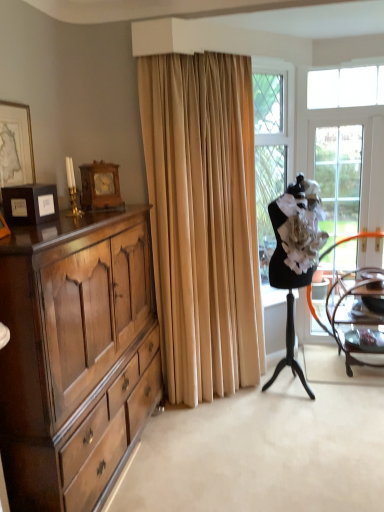
This screenshot has width=384, height=512. Describe the element at coordinates (75, 355) in the screenshot. I see `polished wood cabinet at left` at that location.

What do you see at coordinates (16, 145) in the screenshot?
I see `gold-framed picture at upper left` at bounding box center [16, 145].

The height and width of the screenshot is (512, 384). What do you see at coordinates (357, 315) in the screenshot? I see `wooden chair at right` at bounding box center [357, 315].

In order to click on polished wood cabinet at left in this screenshot , I will do `click(75, 355)`.

Which object is closer to the camera, clear glass screen door at right or wooden chair at right?

wooden chair at right is more forward.

Considering the positions of objects clear glass screen door at right and wooden chair at right in the image provided, who is more to the left, clear glass screen door at right or wooden chair at right?

From the viewer's perspective, clear glass screen door at right appears more on the left side.

Does clear glass screen door at right have a lesser height compared to wooden chair at right?

No, clear glass screen door at right is not shorter than wooden chair at right.

Considering the sizes of objects clear glass screen door at right and wooden chair at right in the image provided, who is wider, clear glass screen door at right or wooden chair at right?

With larger width is wooden chair at right.

From a real-world perspective, is beige velvet curtain at center above or below gold-framed picture at upper left?

beige velvet curtain at center is situated lower than gold-framed picture at upper left in the real world.

Which of these two, beige velvet curtain at center or gold-framed picture at upper left, is smaller?

Smaller between the two is gold-framed picture at upper left.

From the image's perspective, is beige velvet curtain at center below gold-framed picture at upper left?

Yes, from the image's perspective, beige velvet curtain at center is below gold-framed picture at upper left.

The width and height of the screenshot is (384, 512). I want to click on picture frame lying above the beige velvet curtain at center (from the image's perspective), so click(x=16, y=145).

Does point (331, 291) come farther from viewer compared to point (23, 176)?

Yes, it is behind point (23, 176).

From a real-world perspective, relative to gold-framed picture at upper left, is wooden chair at right vertically above or below?

wooden chair at right is situated lower than gold-framed picture at upper left in the real world.

Is wooden chair at right at the right side of gold-framed picture at upper left?

Indeed, wooden chair at right is positioned on the right side of gold-framed picture at upper left.

Measure the distance from wooden chair at right to gold-framed picture at upper left.

They are 2.51 meters apart.

Between gold-framed picture at upper left and polished wood cabinet at left, which one is positioned behind?

gold-framed picture at upper left.

What are the coordinates of `cabinetry on the right of gold-framed picture at upper left` in the screenshot? It's located at (75, 355).

Considering the sizes of objects gold-framed picture at upper left and polished wood cabinet at left in the image provided, who is wider, gold-framed picture at upper left or polished wood cabinet at left?

With larger width is polished wood cabinet at left.

In the image, is white fabric ballet dancer at right positioned in front of or behind polished wood cabinet at left?

white fabric ballet dancer at right is behind polished wood cabinet at left.

Does point (292, 252) appear closer or farther from the camera than point (108, 384)?

Point (292, 252) appears to be farther away from the viewer than point (108, 384).

Considering the sizes of white fabric ballet dancer at right and polished wood cabinet at left in the image, is white fabric ballet dancer at right taller or shorter than polished wood cabinet at left?

white fabric ballet dancer at right is taller than polished wood cabinet at left.

Is white fabric ballet dancer at right wider than polished wood cabinet at left?

No.

In the image, is gold-framed picture at upper left on the left side or the right side of white fabric ballet dancer at right?

gold-framed picture at upper left is to the left of white fabric ballet dancer at right.

In terms of width, does gold-framed picture at upper left look wider or thinner when compared to white fabric ballet dancer at right?

gold-framed picture at upper left is thinner than white fabric ballet dancer at right.

Locate an element on the screen. The width and height of the screenshot is (384, 512). ballet dancer located underneath the gold-framed picture at upper left (from a real-world perspective) is located at coordinates (295, 254).

What's the angular difference between gold-framed picture at upper left and white fabric ballet dancer at right's facing directions?

There is a 32-degree angle between the facing directions of gold-framed picture at upper left and white fabric ballet dancer at right.

In terms of size, does gold-framed picture at upper left appear bigger or smaller than wooden chair at right?

→ Considering their sizes, gold-framed picture at upper left takes up less space than wooden chair at right.

Is gold-framed picture at upper left outside of wooden chair at right?

That's correct, gold-framed picture at upper left is outside of wooden chair at right.

Considering the sizes of gold-framed picture at upper left and wooden chair at right in the image, is gold-framed picture at upper left taller or shorter than wooden chair at right?

gold-framed picture at upper left is shorter than wooden chair at right.

Locate an element on the screen. chair below the clear glass screen door at right (from a real-world perspective) is located at coordinates (357, 315).

Locate an element on the screen. This screenshot has width=384, height=512. curtain behind the gold-framed picture at upper left is located at coordinates (202, 221).

Considering their positions, is white fabric ballet dancer at right positioned further to wooden chair at right than beige velvet curtain at center?

Among the two, beige velvet curtain at center is located further to wooden chair at right.

Which object lies further to the anchor point white fabric ballet dancer at right, polished wood cabinet at left or beige velvet curtain at center?

polished wood cabinet at left.

Based on the photo, which object lies nearer to the anchor point wooden chair at right, beige velvet curtain at center or polished wood cabinet at left?

The object closer to wooden chair at right is beige velvet curtain at center.

Based on their spatial positions, is white fabric ballet dancer at right or beige velvet curtain at center closer to gold-framed picture at upper left?

Based on the image, beige velvet curtain at center appears to be nearer to gold-framed picture at upper left.

Estimate the real-world distances between objects in this image. Which object is further from wooden chair at right, beige velvet curtain at center or clear glass screen door at right?

Among the two, beige velvet curtain at center is located further to wooden chair at right.

When comparing their distances from beige velvet curtain at center, does polished wood cabinet at left or clear glass screen door at right seem closer?

Among the two, polished wood cabinet at left is located nearer to beige velvet curtain at center.

Which object lies nearer to the anchor point beige velvet curtain at center, polished wood cabinet at left or white fabric ballet dancer at right?

Among the two, white fabric ballet dancer at right is located nearer to beige velvet curtain at center.

Considering their positions, is clear glass screen door at right positioned further to white fabric ballet dancer at right than wooden chair at right?

clear glass screen door at right.

This screenshot has height=512, width=384. Find the location of `curtain between polished wood cabinet at left and clear glass screen door at right along the z-axis`. curtain between polished wood cabinet at left and clear glass screen door at right along the z-axis is located at coordinates (202, 221).

At what (x,y) coordinates should I click in order to perform the action: click on curtain located between polished wood cabinet at left and wooden chair at right in the left-right direction. Please return your answer as a coordinate pair (x, y). Looking at the image, I should click on (202, 221).

Where is `curtain between gold-framed picture at upper left and wooden chair at right`? This screenshot has height=512, width=384. curtain between gold-framed picture at upper left and wooden chair at right is located at coordinates (202, 221).

This screenshot has width=384, height=512. What are the coordinates of `screen door located between gold-framed picture at upper left and wooden chair at right in the left-right direction` in the screenshot? It's located at (339, 177).